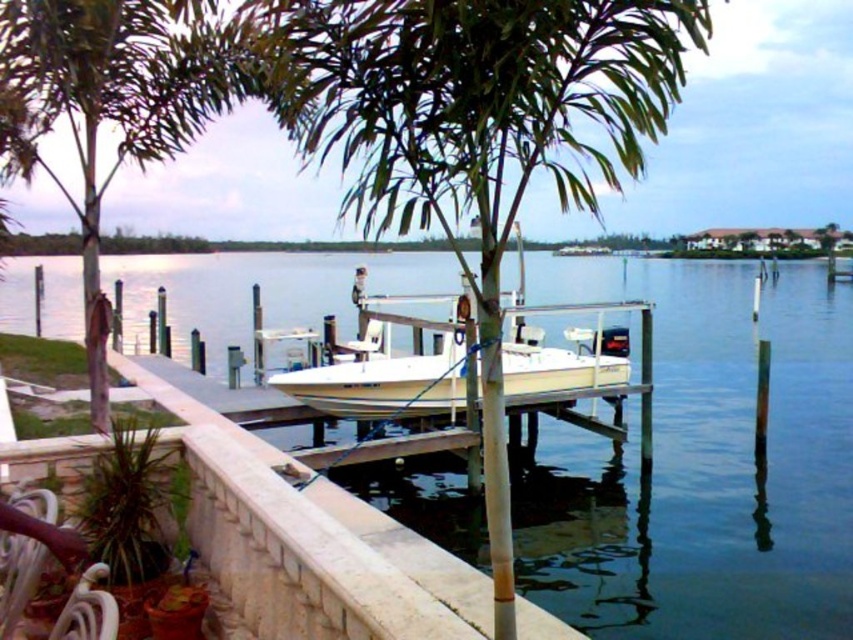
Question: Can you confirm if clear blue water at center is bigger than white matte boat at center?

Choices:
 (A) yes
 (B) no

Answer: (A)

Question: Does clear blue water at center have a greater width compared to green leafy palm tree at center?

Choices:
 (A) no
 (B) yes

Answer: (B)

Question: From the image, what is the correct spatial relationship of green leafy palm tree at center in relation to white matte boat at center?

Choices:
 (A) right
 (B) left

Answer: (A)

Question: Which object appears closest to the camera in this image?

Choices:
 (A) green leafy palm tree at center
 (B) white matte boat at center
 (C) clear blue water at center

Answer: (A)

Question: Among these objects, which one is nearest to the camera?

Choices:
 (A) white matte boat at center
 (B) green leafy palm tree at center
 (C) clear blue water at center

Answer: (B)

Question: Which point is closer to the camera?

Choices:
 (A) (421, 272)
 (B) (445, 324)

Answer: (B)